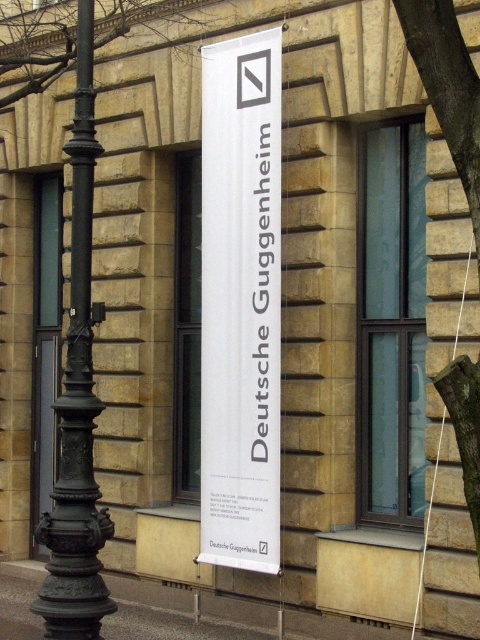
You are standing in front of the building and want to locate the exact point at coordinates point (240, 301). According to the scene, where should you look?

The point (240, 301) is on the white paper banner at center, so you should look at the center of the banner to find it.

You are an architect designing a new building and want to ensure the banner can be seen clearly from the street. Given the white paper banner at center and the black cast iron pole at left, which object is bigger and would be more visible from a distance?

The white paper banner at center has a larger size compared to the black cast iron pole at left, so it would be more visible from a distance.

You are standing in front of the building and want to place a new decorative sticker on the wall between the two points, point (252, 524) and point (56, 589). Which point is closer to you so that the sticker can be placed in front of it?

Point (56, 589) is closer to you, so placing the sticker in front of it would be appropriate.